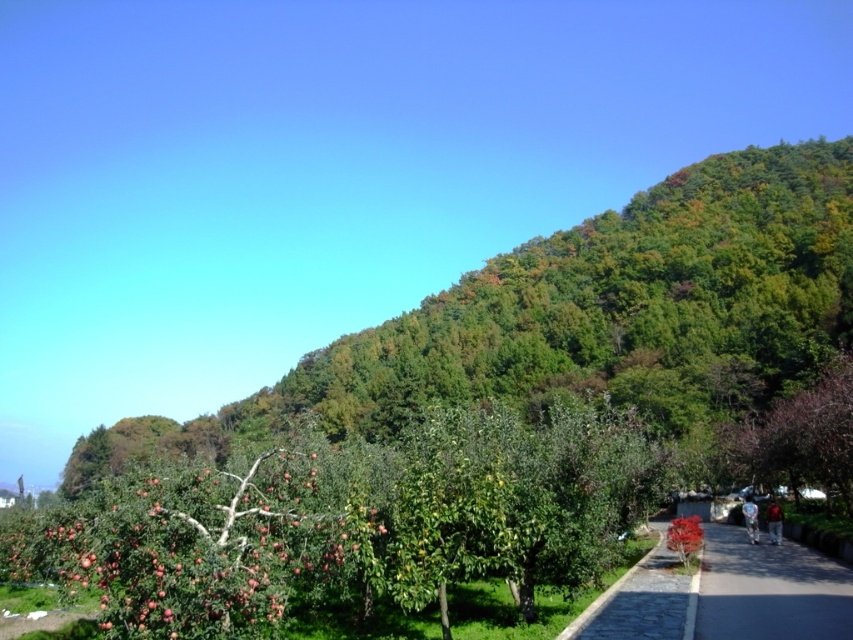
You are standing at the base of the fruit trees and want to place a small basket on the ground near the ripe red apples at lower left without it rolling onto the dark gray asphalt at lower right. Which direction should you place the basket?

The ripe red apples at lower left is above dark gray asphalt at lower right, so placing the basket near the apples would be on higher ground. To prevent it from rolling onto the asphalt, place the basket facing uphill or secure it so it doesn

You are standing at the center of the smooth stone path at center and want to pick some apples from the ripe red apples at lower left. In which direction should you walk to reach the apples?

The ripe red apples at lower left are located to the left of the smooth stone path at center, so you should walk to your left to reach them.